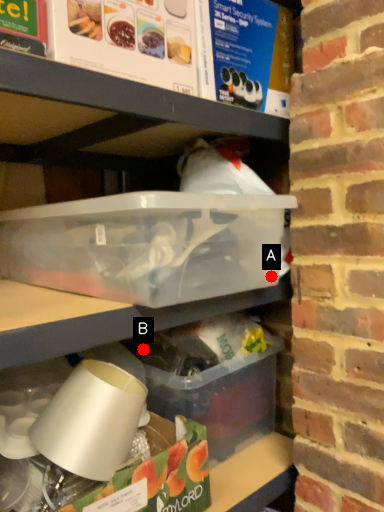
Question: Two points are circled on the image, labeled by A and B beside each circle. Which point is further to the camera?

Choices:
 (A) A is further
 (B) B is further

Answer: (B)